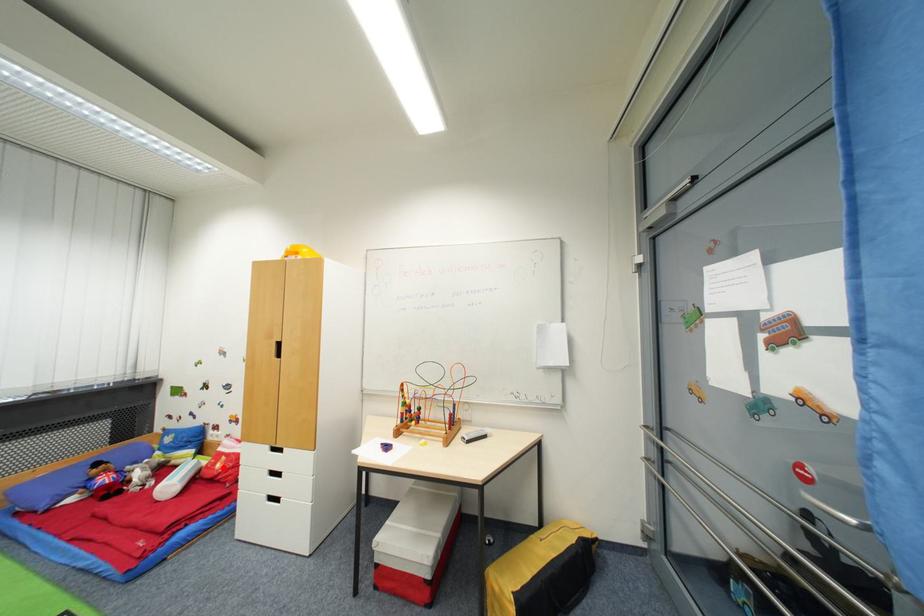
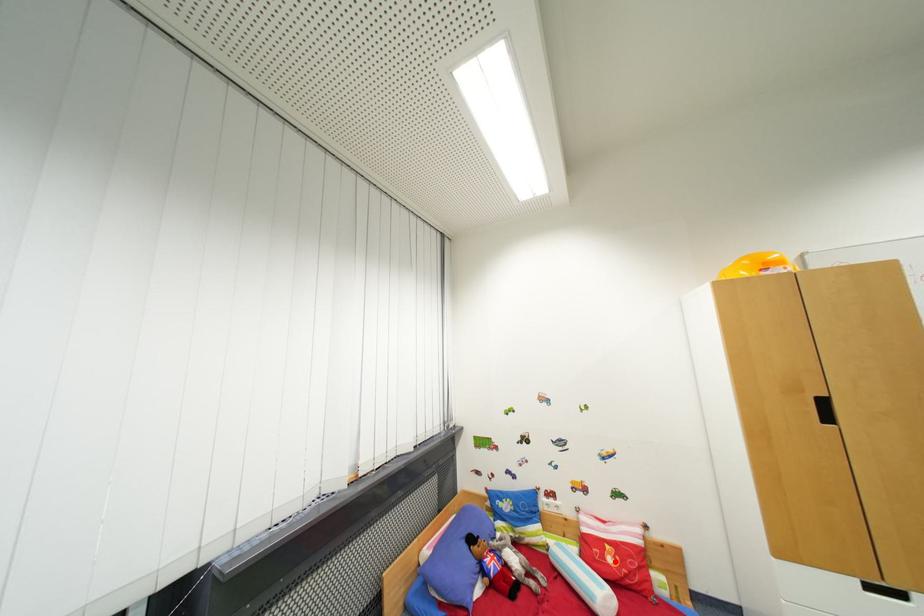
I am providing you with two images of the same scene from different viewpoints. A red point is marked on the first image and another point is marked on the second image. Is the red point in image1 aligned with the point shown in image2?

Yes